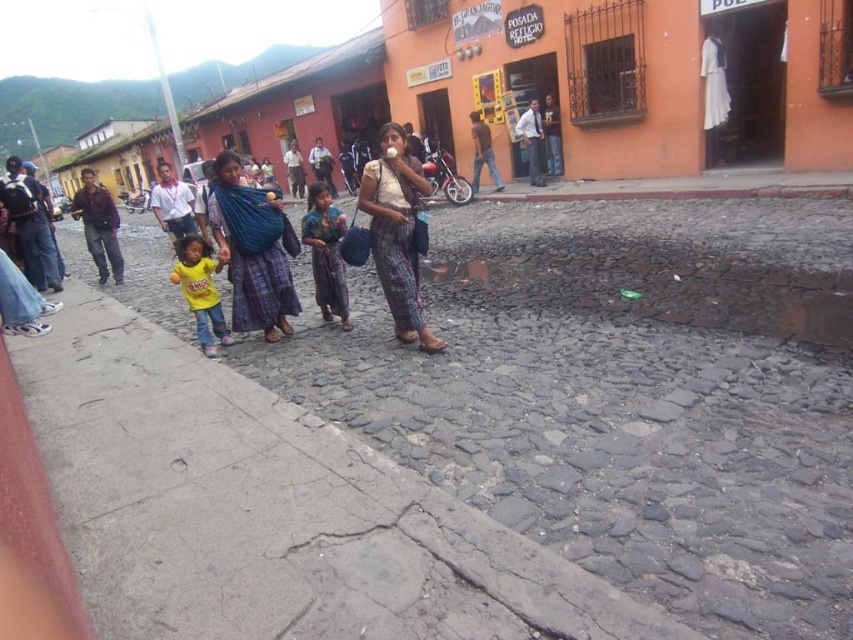
Question: Which object is positioned closest to the printed fabric dress at center?

Choices:
 (A) yellow matte shirt at center
 (B) blue woven fabric at center
 (C) white cotton blouse at center
 (D) gray cobblestone pavement at center

Answer: (B)

Question: Does gray cobblestone pavement at center appear on the right side of printed fabric dress at center?

Choices:
 (A) yes
 (B) no

Answer: (A)

Question: Is gray cobblestone pavement at center wider than yellow matte shirt at center?

Choices:
 (A) no
 (B) yes

Answer: (B)

Question: Is gray cobblestone pavement at center to the right of blue woven fabric at center from the viewer's perspective?

Choices:
 (A) yes
 (B) no

Answer: (A)

Question: Which object appears closest to the camera in this image?

Choices:
 (A) white cotton blouse at center
 (B) blue woven fabric at center
 (C) yellow matte shirt at center
 (D) printed fabric dress at center

Answer: (A)

Question: Which object is positioned farthest from the white cotton blouse at center?

Choices:
 (A) blue woven fabric at center
 (B) gray cobblestone pavement at center
 (C) yellow matte shirt at center
 (D) printed fabric dress at center

Answer: (B)